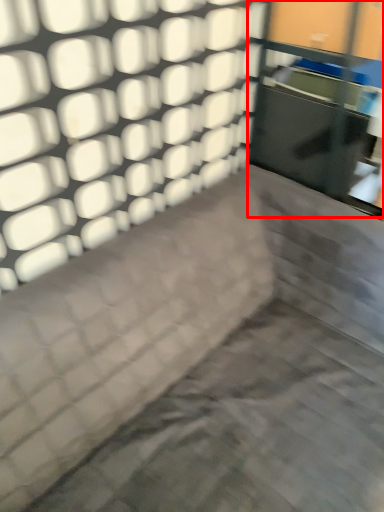
Question: From the image's perspective, where is glass door (annotated by the red box) located in relation to furniture in the image?

Choices:
 (A) below
 (B) above

Answer: (B)